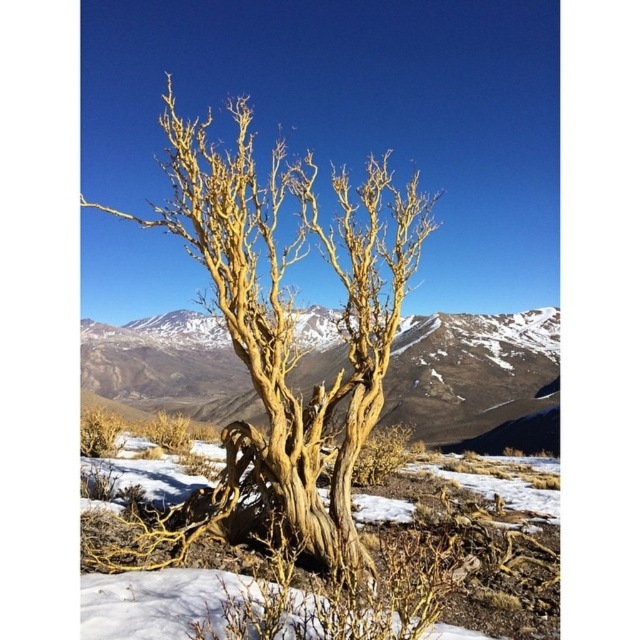
Does golden textured tree at center appear on the left side of light brown bark tree at center?

In fact, golden textured tree at center is to the right of light brown bark tree at center.

Between point (387, 326) and point (442, 412), which one is positioned behind?

The point (442, 412) is more distant.

Image resolution: width=640 pixels, height=640 pixels. What are the coordinates of `golden textured tree at center` in the screenshot? It's located at (284, 336).